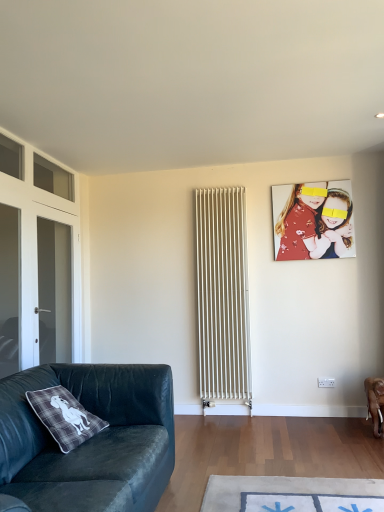
The height and width of the screenshot is (512, 384). Find the location of `vacant location below matte red shirt at upper right (from a real-world perspective)`. vacant location below matte red shirt at upper right (from a real-world perspective) is located at coordinates (317, 412).